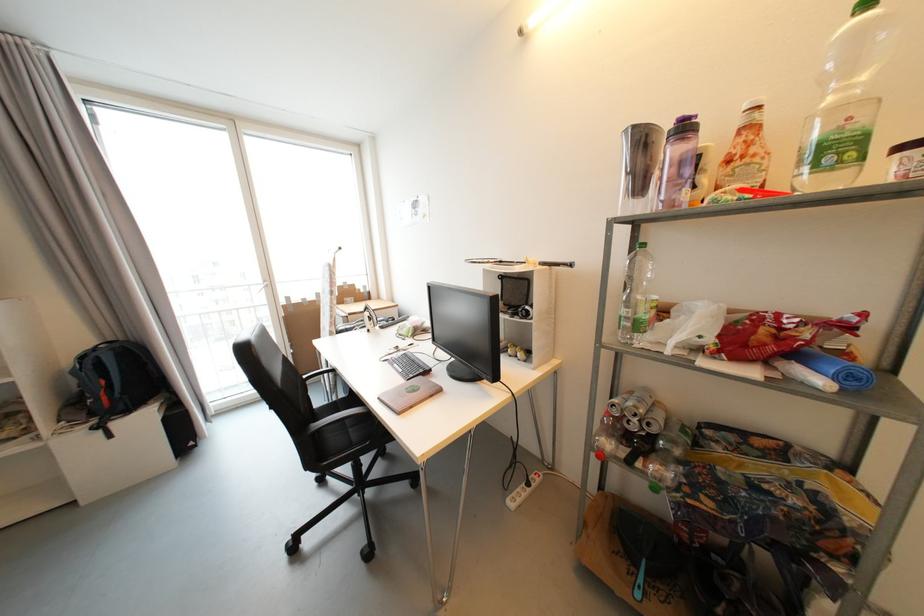
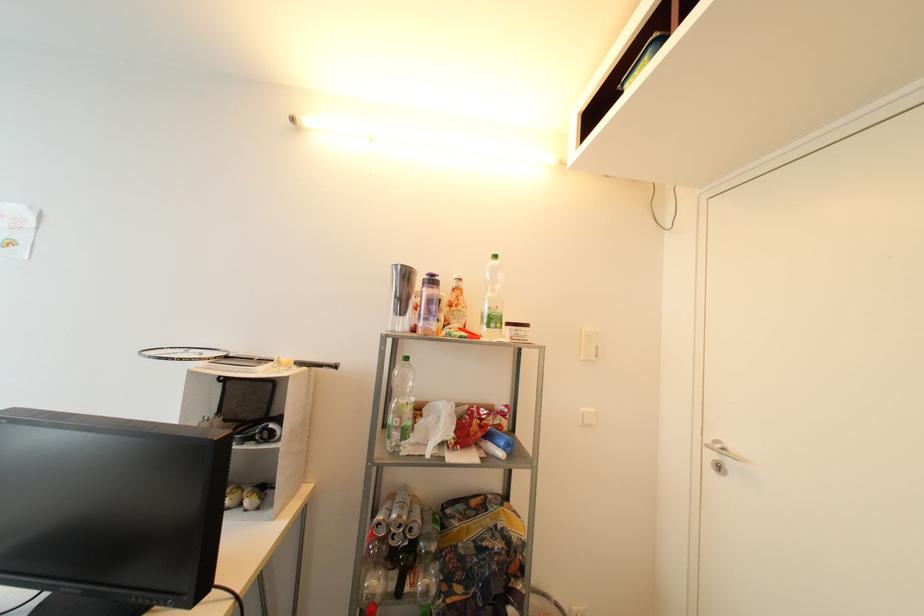
The point at (748, 159) is marked in the first image. Where is the corresponding point in the second image?

(462, 307)